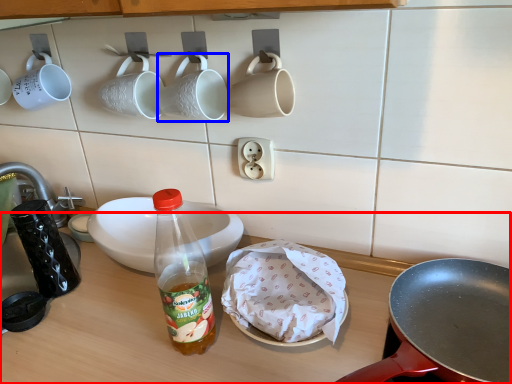
Question: Which point is further to the camera, table top (highlighted by a red box) or coffee cup (highlighted by a blue box)?

Choices:
 (A) table top
 (B) coffee cup

Answer: (B)